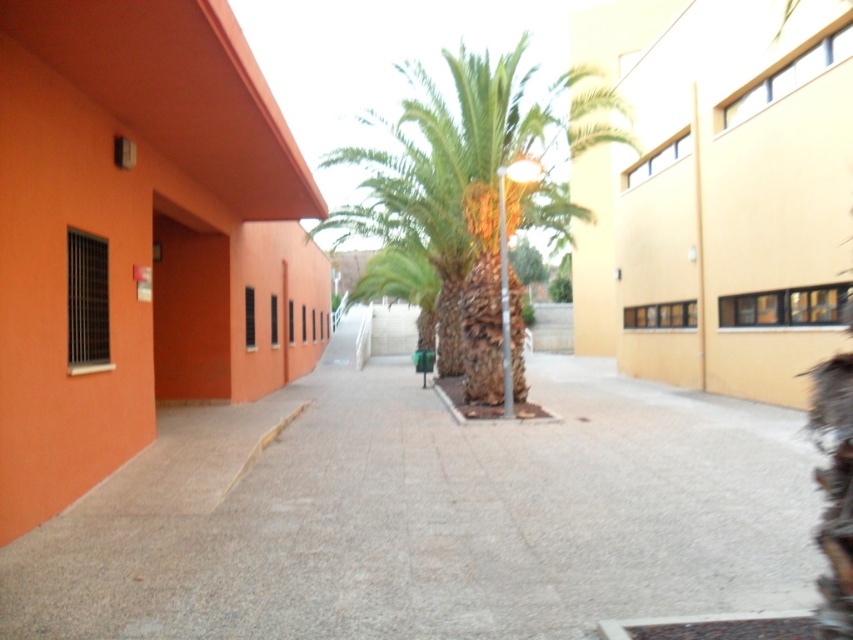
Question: Can you confirm if gray concrete pavement at center is positioned to the right of green leafy palm at center?

Choices:
 (A) no
 (B) yes

Answer: (A)

Question: Does gray concrete pavement at center have a larger size compared to green leafy palm at center?

Choices:
 (A) yes
 (B) no

Answer: (B)

Question: Is gray concrete pavement at center to the right of green leafy palm at center from the viewer's perspective?

Choices:
 (A) yes
 (B) no

Answer: (B)

Question: Among these objects, which one is nearest to the camera?

Choices:
 (A) green leafy palm at center
 (B) gray concrete pavement at center

Answer: (B)